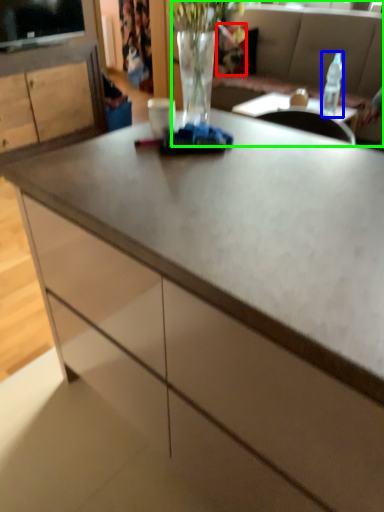
Question: Which is nearer to the flower (highlighted by a red box)? bottle (highlighted by a blue box) or studio couch (highlighted by a green box).

Choices:
 (A) bottle
 (B) studio couch

Answer: (B)